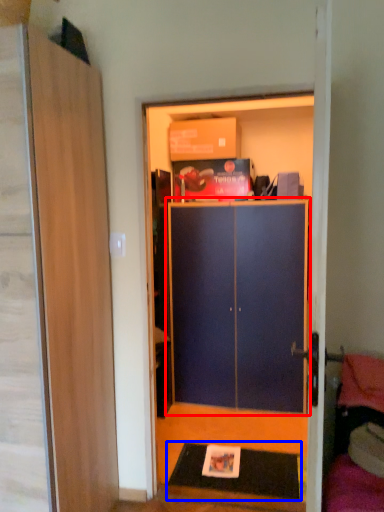
Question: Which point is closer to the camera, cabinetry (highlighted by a red box) or doormat (highlighted by a blue box)?

Choices:
 (A) cabinetry
 (B) doormat

Answer: (B)